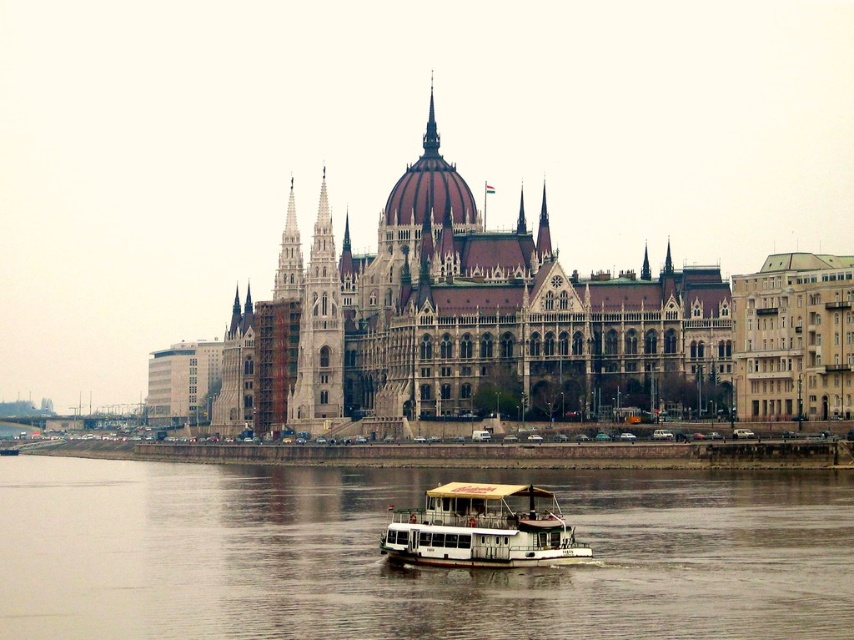
You are an architect analyzing the image of the building. You need to determine the exact 2D coordinates of the brown water at center in the image. What are its coordinates?

The brown water at center is located at the 2D coordinates of point (410, 570).